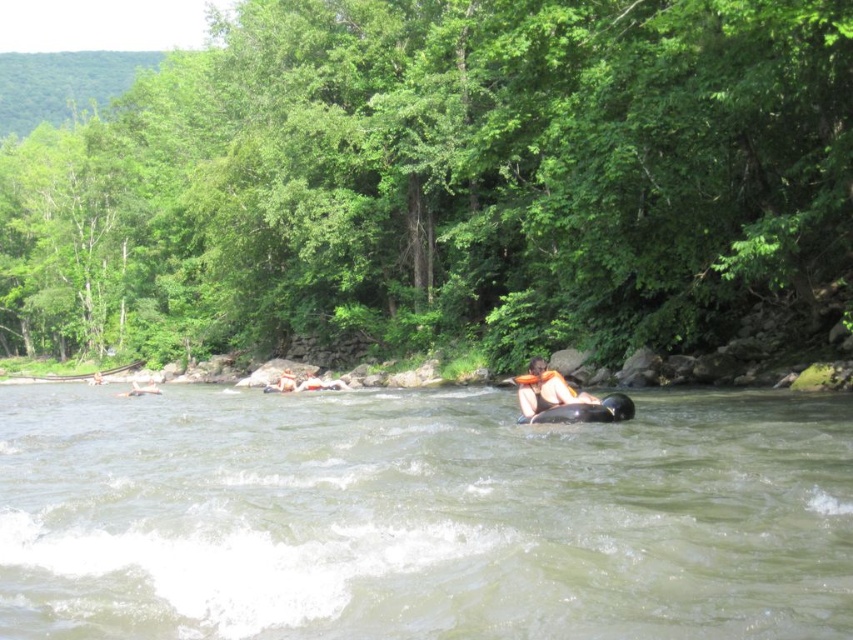
You are a photographer positioned at the riverbank aiming to capture both points in a single shot. Which point, point (270, 540) or point (537, 378), will appear larger in your photo?

Point (270, 540) will appear larger in the photo because it is closer to the viewer than point (537, 378).

You are a safety inspector assessing the scene. The safety guidelines require that any life jacket must be within 5 feet of the person it is intended for. Given the distance between the rubber black tube at center and the orange fabric life jacket at center, does this setup comply with the safety guidelines?

The rubber black tube at center and orange fabric life jacket at center are 6.99 feet apart, which exceeds the 5 feet requirement. Therefore, this setup does not comply with the safety guidelines.